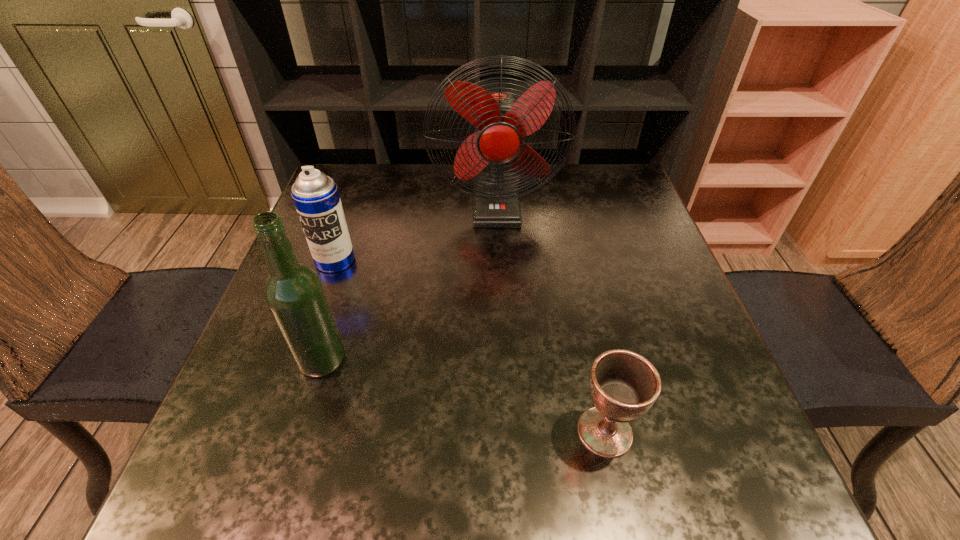
The height and width of the screenshot is (540, 960). I want to click on blank space located 0.110m on the label side of the aerosol can, so 318,310.

At what (x,y) coordinates should I click in order to perform the action: click on vacant space located on the left of the chalice. Please return your answer as a coordinate pair (x, y). The height and width of the screenshot is (540, 960). Looking at the image, I should click on (363, 431).

Where is `object positioned at the far edge`? object positioned at the far edge is located at coordinates (502, 120).

Image resolution: width=960 pixels, height=540 pixels. I want to click on object that is at the near edge, so click(624, 385).

At what (x,y) coordinates should I click in order to perform the action: click on liquor present at the left edge. Please return your answer as a coordinate pair (x, y). Looking at the image, I should click on (294, 293).

The width and height of the screenshot is (960, 540). Identify the location of aerosol can that is at the left edge. (315, 195).

This screenshot has width=960, height=540. I want to click on free spot at the far edge of the desktop, so click(x=456, y=202).

This screenshot has width=960, height=540. I want to click on free point at the near edge, so (650, 456).

In order to click on vacant region at the left edge of the desktop in this screenshot , I will do point(248,347).

In the image, there is a desktop. Identify the location of vacant area at the right edge. (639, 226).